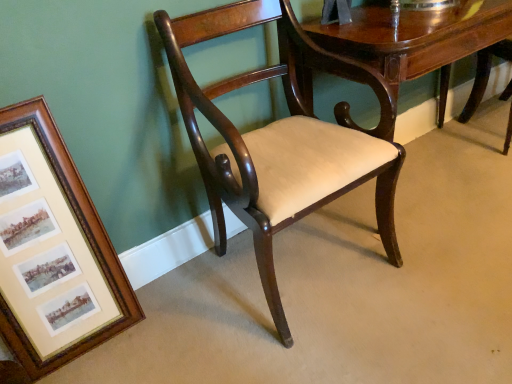
You are a GUI agent. You are given a task and a screenshot of the screen. Output one action in this format:
    pyautogui.click(x=<x>, y=<y>)
    Task: Click on the vacant region below mahogany wood chair at center (from a real-world perspective)
    
    Given the screenshot: What is the action you would take?
    pyautogui.click(x=304, y=264)